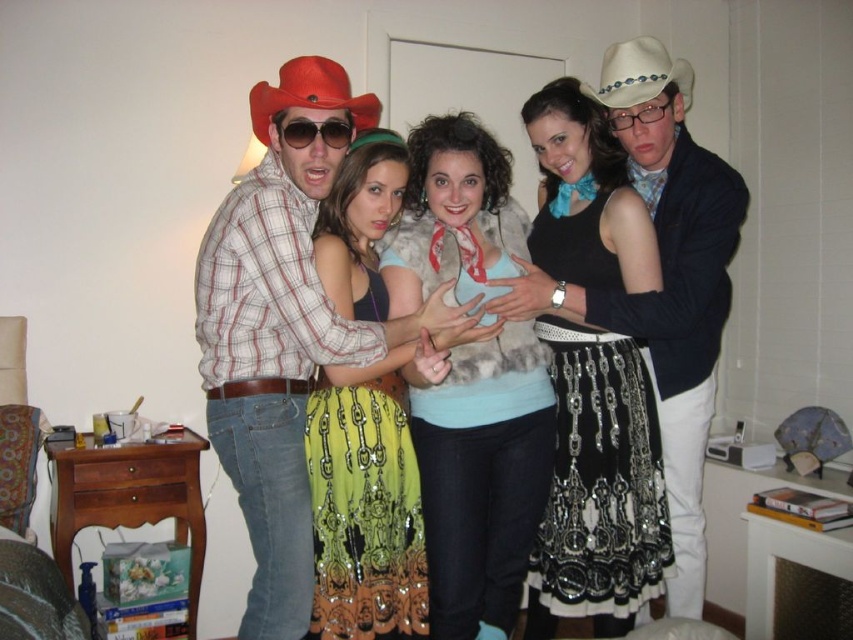
Question: Is white matte cowboy hat at right closer to camera compared to black plastic glasses at center?

Choices:
 (A) yes
 (B) no

Answer: (A)

Question: Considering the relative positions of matte plaid shirt at center and sunglasses at center in the image provided, where is matte plaid shirt at center located with respect to sunglasses at center?

Choices:
 (A) right
 (B) left

Answer: (A)

Question: Which of the following is the farthest from the observer?

Choices:
 (A) black sequined skirt at center
 (B) matte plaid shirt at center

Answer: (A)

Question: Which of the following is the closest to the observer?

Choices:
 (A) [595, 387]
 (B) [367, 248]
 (C) [341, 138]

Answer: (C)

Question: Is red felt cowboy hat at upper left above sunglasses at center?

Choices:
 (A) yes
 (B) no

Answer: (A)

Question: Which point is farther to the camera?

Choices:
 (A) (329, 140)
 (B) (590, 550)
 (C) (274, 86)

Answer: (C)